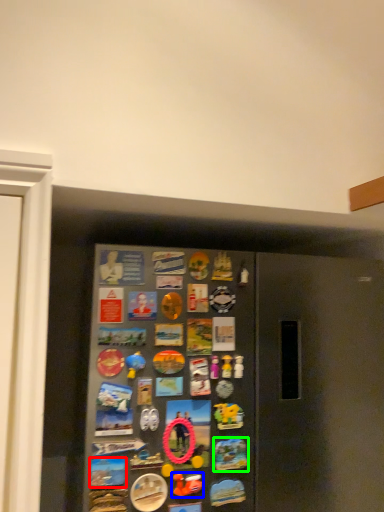
Question: Considering the real-world distances, which object is farthest from button (highlighted by a red box)? art (highlighted by a blue box) or button (highlighted by a green box)?

Choices:
 (A) art
 (B) button

Answer: (B)